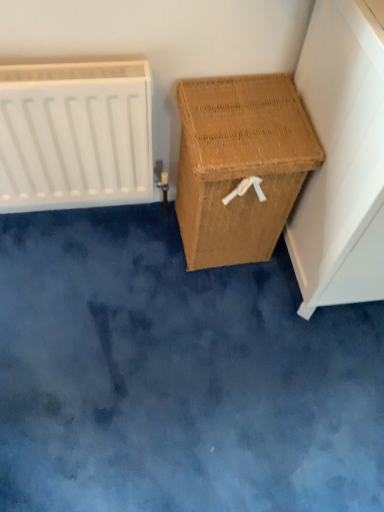
Question: Is the depth of woven brown basket at right, which is counted as the first furniture, starting from the left, less than that of white matte radiator at left?

Choices:
 (A) yes
 (B) no

Answer: (B)

Question: Considering the relative sizes of woven brown basket at right, marked as the second furniture in a right-to-left arrangement, and white matte radiator at left in the image provided, is woven brown basket at right, marked as the second furniture in a right-to-left arrangement, wider than white matte radiator at left?

Choices:
 (A) no
 (B) yes

Answer: (B)

Question: Does woven brown basket at right, marked as the second furniture in a right-to-left arrangement, come behind white matte radiator at left?

Choices:
 (A) no
 (B) yes

Answer: (B)

Question: Does woven brown basket at right, which is counted as the first furniture, starting from the left, have a larger size compared to white matte radiator at left?

Choices:
 (A) yes
 (B) no

Answer: (A)

Question: Is white matte radiator at left located within woven brown basket at right, which is counted as the first furniture, starting from the left?

Choices:
 (A) yes
 (B) no

Answer: (B)

Question: In terms of width, does woven brown laundry basket at right, the 1th furniture in the right-to-left sequence, look wider or thinner when compared to woven brown basket at right, which is counted as the first furniture, starting from the left?

Choices:
 (A) wide
 (B) thin

Answer: (A)

Question: Does point (339, 47) appear closer or farther from the camera than point (281, 143)?

Choices:
 (A) farther
 (B) closer

Answer: (B)

Question: From a real-world perspective, is woven brown laundry basket at right, which is the second furniture in left-to-right order, positioned above or below woven brown basket at right, which is counted as the first furniture, starting from the left?

Choices:
 (A) below
 (B) above

Answer: (B)

Question: Choose the correct answer: Is woven brown laundry basket at right, the 1th furniture in the right-to-left sequence, inside woven brown basket at right, which is counted as the first furniture, starting from the left, or outside it?

Choices:
 (A) outside
 (B) inside

Answer: (A)

Question: From the image's perspective, is white matte radiator at left above or below woven brown basket at right, marked as the second furniture in a right-to-left arrangement?

Choices:
 (A) below
 (B) above

Answer: (B)

Question: Considering the positions of white matte radiator at left and woven brown basket at right, which is counted as the first furniture, starting from the left, in the image, is white matte radiator at left wider or thinner than woven brown basket at right, which is counted as the first furniture, starting from the left,?

Choices:
 (A) thin
 (B) wide

Answer: (A)

Question: Visually, is white matte radiator at left positioned to the left or to the right of woven brown basket at right, marked as the second furniture in a right-to-left arrangement?

Choices:
 (A) right
 (B) left

Answer: (B)

Question: Does point (134, 152) appear closer or farther from the camera than point (221, 108)?

Choices:
 (A) farther
 (B) closer

Answer: (A)

Question: Based on their sizes in the image, would you say woven brown basket at right, which is counted as the first furniture, starting from the left, is bigger or smaller than white matte radiator at left?

Choices:
 (A) small
 (B) big

Answer: (B)

Question: Considering their positions, is woven brown basket at right, marked as the second furniture in a right-to-left arrangement, located in front of or behind white matte radiator at left?

Choices:
 (A) behind
 (B) front

Answer: (A)